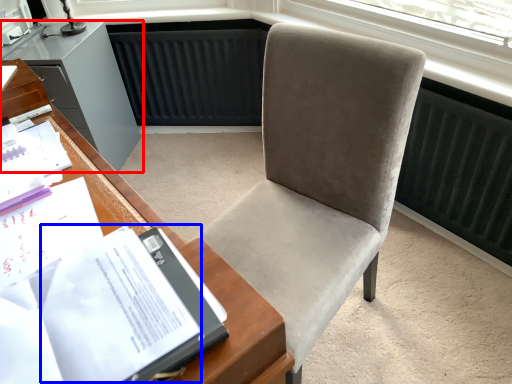
Question: Which object appears closest to the camera in this image, cabinetry (highlighted by a red box) or journal (highlighted by a blue box)?

Choices:
 (A) cabinetry
 (B) journal

Answer: (B)